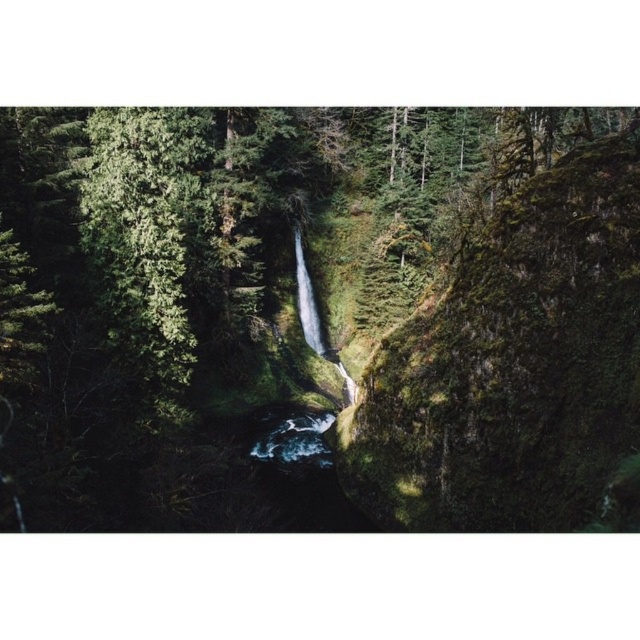
You are standing in the forest scene and want to place a small decorative statue on the green mossy rock at center. Given that the statue requires a flat surface of at least 0.5 square meters, can you determine if the rock has sufficient space?

The green mossy rock at center is located at point coordinates, but the provided information does not specify its surface area. Therefore, it is unclear if the rock has enough flat space for the statue.

You are a hiker navigating through the forest and see two points marked in the scene. Which point is closer to you, the point at coordinate (566,408) or the point at (324,348)?

Point (566,408) is in front of point (324,348), so the point at coordinate (566,408) is closer to you.